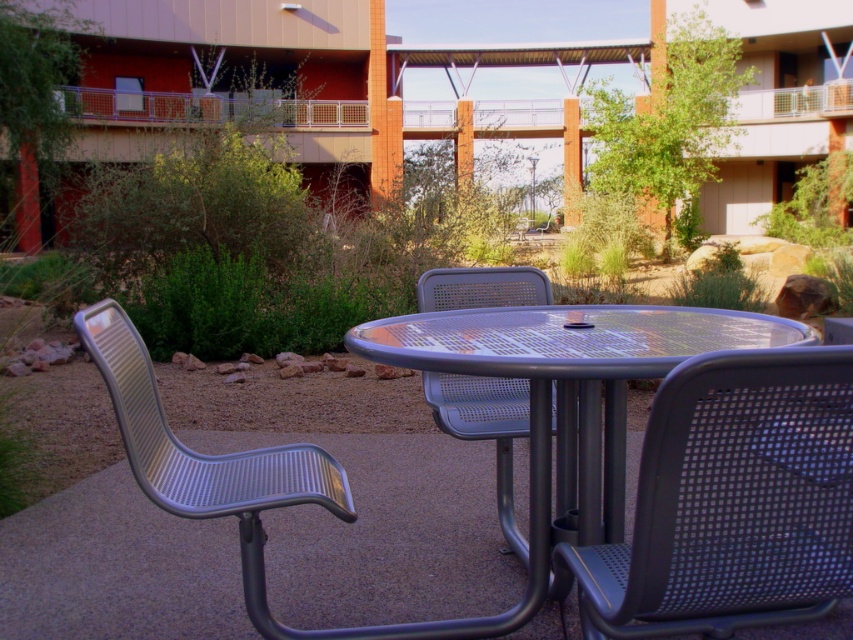
You are planning to place a 1.2 meter wide plant pot between the metallic mesh chair at left and the metal mesh chair at center. Based on their widths, will there be enough space for the plant pot to fit between them?

The metallic mesh chair at left is wider than the metal mesh chair at center. However, the exact widths are not provided, so it is uncertain if there is enough space for the 1.2 meter wide plant pot between them.

You are a visitor at the campus and want to choose a chair that is taller for better visibility. Which chair between the metallic mesh chair at left and the metal mesh chair at center should you pick?

The metallic mesh chair at left is taller than the metal mesh chair at center, so you should pick the metallic mesh chair at left for better visibility.

From the picture: You are standing at the entrance of the outdoor seating area and want to find the metallic mesh table at center. According to the coordinates provided, where should you look to locate it?

The metallic mesh table at center is located at coordinates point [566,339], so you should look towards the lower center area of the image to find it.